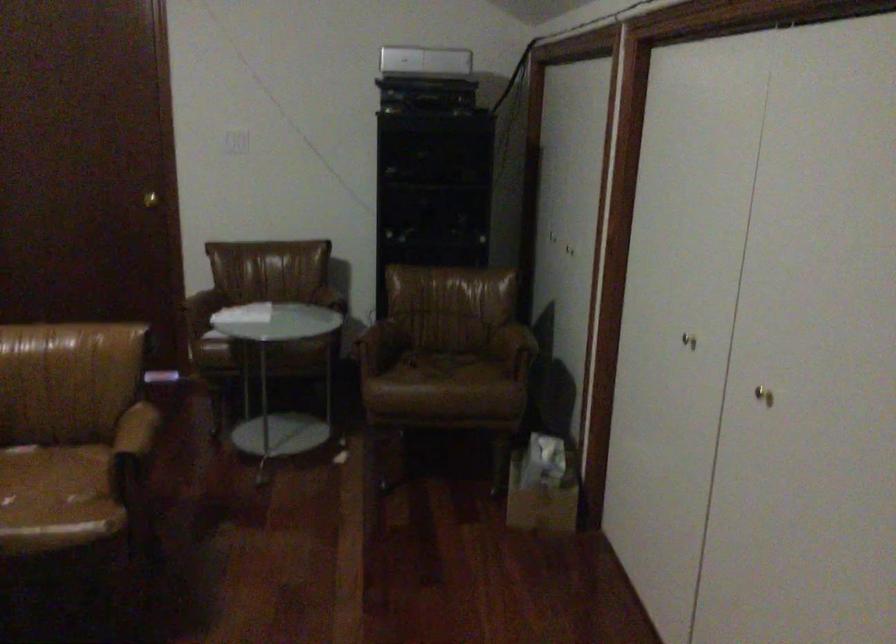
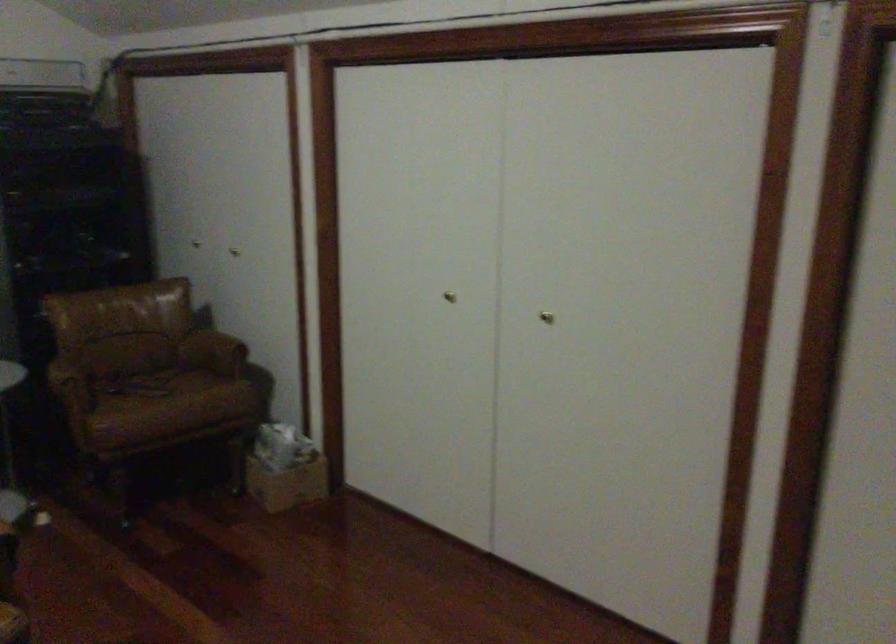
In the second image, find the point that corresponds to the point at 760,382 in the first image.

(546, 317)